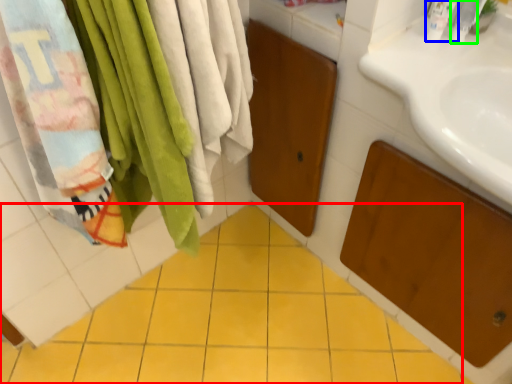
Question: Which object is the closest to the ceramic tile (highlighted by a red box)? Choose among these: toiletry (highlighted by a blue box) or toiletry (highlighted by a green box).

Choices:
 (A) toiletry
 (B) toiletry

Answer: (A)